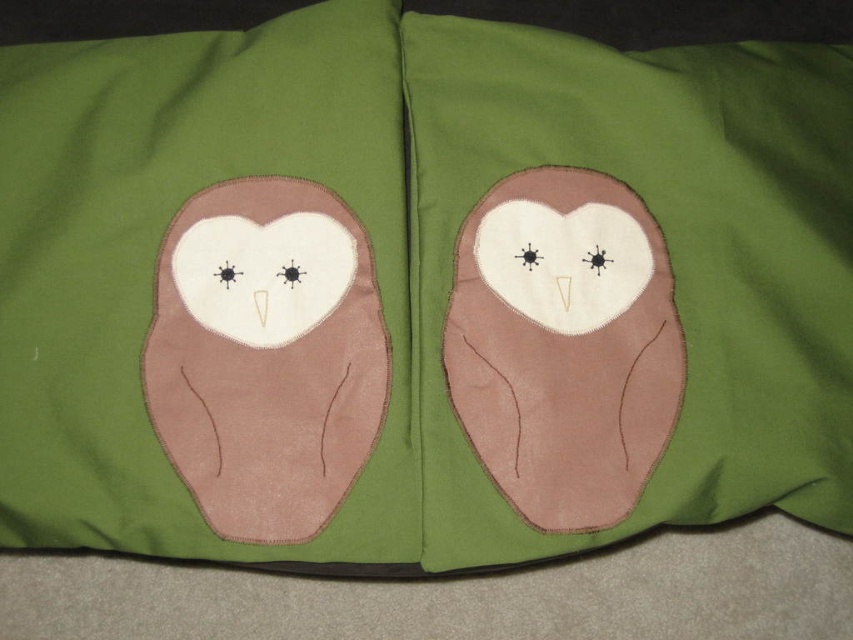
Does point (173, 209) come farther from viewer compared to point (457, 321)?

Yes.

Between suede brown owl at center and brown felt owl at center, which one is positioned lower?

brown felt owl at center is lower down.

Who is more forward, (x=86, y=416) or (x=648, y=328)?

Positioned in front is point (x=86, y=416).

Where is `suede brown owl at center`? suede brown owl at center is located at coordinates (206, 292).

Does suede brown owl at center have a larger size compared to brown felt owl at left?

Correct, suede brown owl at center is larger in size than brown felt owl at left.

Does suede brown owl at center have a lesser height compared to brown felt owl at left?

No, suede brown owl at center is not shorter than brown felt owl at left.

Locate an element on the screen. This screenshot has width=853, height=640. suede brown owl at center is located at coordinates (206, 292).

In the scene shown: Is brown felt owl at left to the right of brown felt owl at center from the viewer's perspective?

In fact, brown felt owl at left is to the left of brown felt owl at center.

Who is lower down, brown felt owl at left or brown felt owl at center?

Positioned lower is brown felt owl at left.

What do you see at coordinates (265, 355) in the screenshot? The image size is (853, 640). I see `brown felt owl at left` at bounding box center [265, 355].

Find the location of a particular element. The image size is (853, 640). brown felt owl at left is located at coordinates (265, 355).